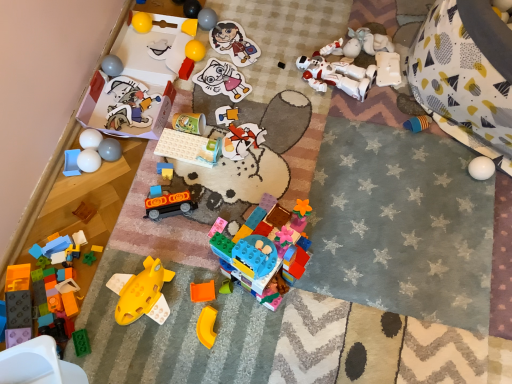
You are a GUI agent. You are given a task and a screenshot of the screen. Output one action in this format:
    pyautogui.click(x=<x>, y=<y>)
    Task: Click on the vacant space that is in between black plastic train at center, the 14th toy from the right, and orange matte toy airplane at center, which is the eighth toy from right to left
    
    Given the screenshot: What is the action you would take?
    pyautogui.click(x=184, y=252)